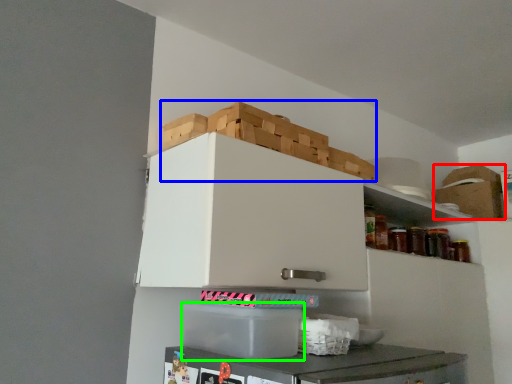
Question: Which object is the closest to the cardboard box (highlighted by a red box)? Choose among these: crate (highlighted by a blue box) or cardboard box (highlighted by a green box).

Choices:
 (A) crate
 (B) cardboard box

Answer: (A)